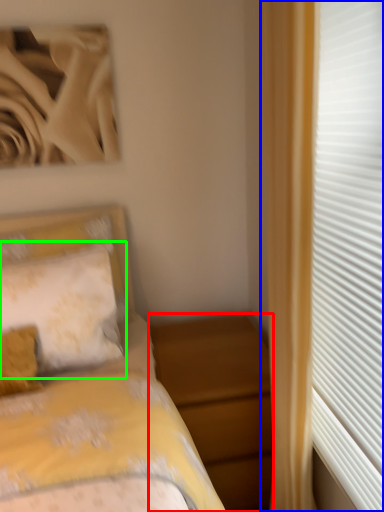
Question: Which object is positioned closest to nightstand (highlighted by a red box)? Select from curtain (highlighted by a blue box) and pillow (highlighted by a green box).

Choices:
 (A) curtain
 (B) pillow

Answer: (B)